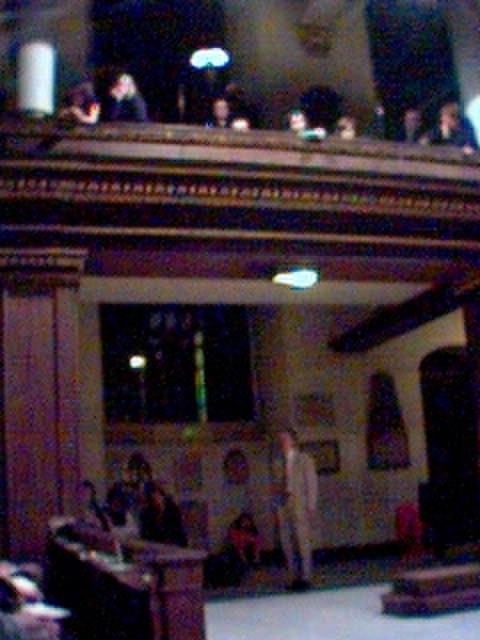
You are standing in the auditorium and want to find the light beige pants at center. According to the coordinates provided, where would you look to locate them?

The light beige pants at center are located at coordinates point (294, 504).

You are an event organizer checking the seating arrangement. You notice the light beige pants at center and the matte black suit at upper center. Which one is positioned higher in the image?

The matte black suit at upper center is positioned higher in the image than the light beige pants at center.